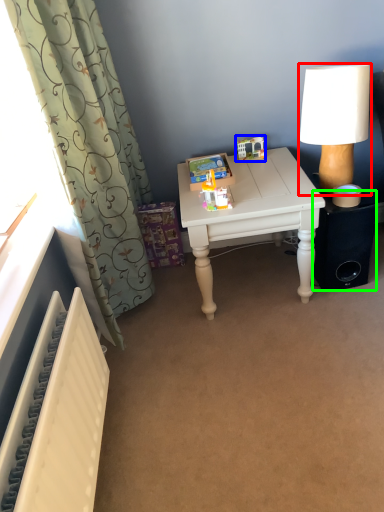
Question: Which object is the closest to the lamp (highlighted by a red box)? Choose among these: toy (highlighted by a blue box) or speaker (highlighted by a green box).

Choices:
 (A) toy
 (B) speaker

Answer: (B)